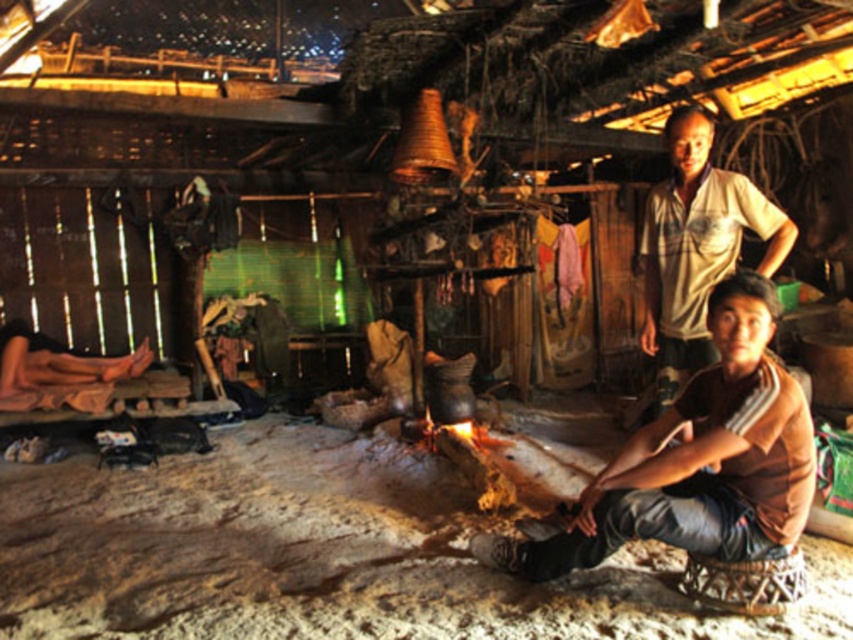
The image size is (853, 640). What do you see at coordinates (695, 248) in the screenshot?
I see `white cotton shirt at upper right` at bounding box center [695, 248].

Who is lower down, white cotton shirt at upper right or brown leather sandals at lower left?

brown leather sandals at lower left

Does point (682, 380) come closer to viewer compared to point (51, 372)?

Yes, point (682, 380) is closer to viewer.

Where is `white cotton shirt at upper right`? white cotton shirt at upper right is located at coordinates (695, 248).

Which is below, brown cotton shirt at lower right or brown leather sandals at lower left?

brown cotton shirt at lower right is lower down.

In the scene shown: Can you confirm if brown cotton shirt at lower right is positioned above brown leather sandals at lower left?

Actually, brown cotton shirt at lower right is below brown leather sandals at lower left.

At what (x,y) coordinates should I click in order to perform the action: click on brown cotton shirt at lower right. Please return your answer as a coordinate pair (x, y). Image resolution: width=853 pixels, height=640 pixels. Looking at the image, I should click on (695, 460).

Between brown cotton shirt at lower right and white cotton shirt at upper right, which one has less height?

brown cotton shirt at lower right is shorter.

Which is more to the left, brown cotton shirt at lower right or white cotton shirt at upper right?

From the viewer's perspective, brown cotton shirt at lower right appears more on the left side.

The image size is (853, 640). What do you see at coordinates (695, 460) in the screenshot? I see `brown cotton shirt at lower right` at bounding box center [695, 460].

Image resolution: width=853 pixels, height=640 pixels. Find the location of `brown cotton shirt at lower right`. brown cotton shirt at lower right is located at coordinates point(695,460).